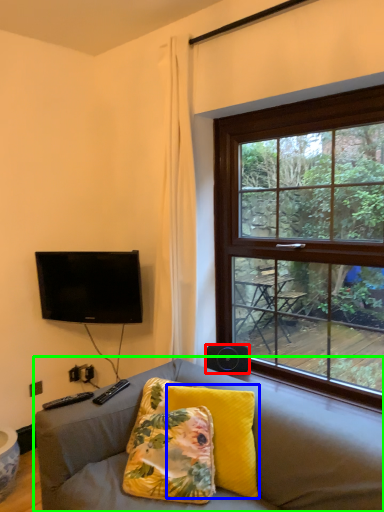
Question: Considering the real-world distances, which object is closest to loudspeaker (highlighted by a red box)? pillow (highlighted by a blue box) or studio couch (highlighted by a green box).

Choices:
 (A) pillow
 (B) studio couch

Answer: (A)